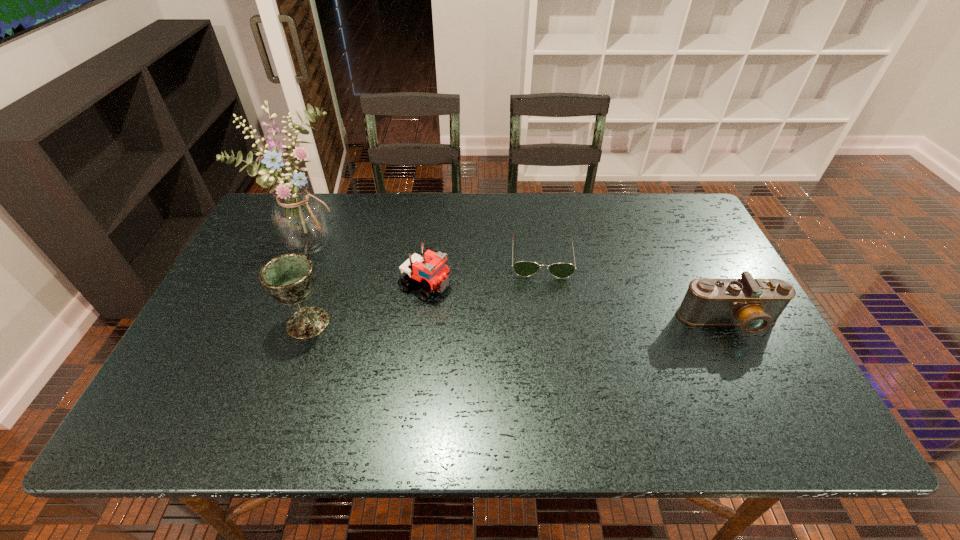
Where is `vacant area between the sunglasses and the tallest object`? This screenshot has height=540, width=960. vacant area between the sunglasses and the tallest object is located at coordinates (424, 249).

Image resolution: width=960 pixels, height=540 pixels. In order to click on free space between the rightmost object and the third object from left to right in this screenshot , I will do `click(577, 303)`.

Find the location of a particular element. This screenshot has height=540, width=960. empty space that is in between the shortest object and the Lego is located at coordinates (483, 271).

At what (x,y) coordinates should I click in order to perform the action: click on the closest object relative to the second tallest object. Please return your answer as a coordinate pair (x, y). This screenshot has height=540, width=960. Looking at the image, I should click on (300, 219).

Identify which object is the third nearest to the tallest object. Please provide its 2D coordinates. Your answer should be formatted as a tuple, i.e. [(x, y)], where the tuple contains the x and y coordinates of a point satisfying the conditions above.

[(522, 268)]

Find the location of a particular element. vacant space that satisfies the following two spatial constraints: 1. on the front side of the third object from left to right; 2. on the left side of the bouquet is located at coordinates (290, 285).